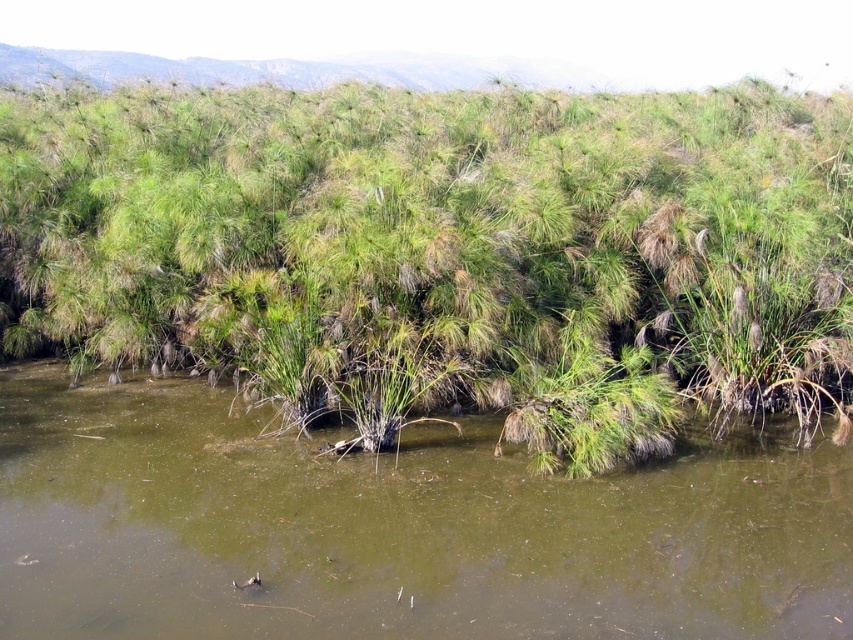
Question: Is green grassy plant at center positioned before green muddy water at center?

Choices:
 (A) yes
 (B) no

Answer: (B)

Question: Can you confirm if green grassy plant at center is bigger than green muddy water at center?

Choices:
 (A) yes
 (B) no

Answer: (A)

Question: In this image, where is green grassy plant at center located relative to green muddy water at center?

Choices:
 (A) above
 (B) below

Answer: (A)

Question: Which of the following is the closest to the observer?

Choices:
 (A) pos(219,548)
 (B) pos(109,305)

Answer: (A)

Question: Which object is closer to the camera taking this photo?

Choices:
 (A) green grassy plant at center
 (B) green muddy water at center

Answer: (B)

Question: Which object is farther from the camera taking this photo?

Choices:
 (A) green muddy water at center
 (B) green grassy plant at center

Answer: (B)